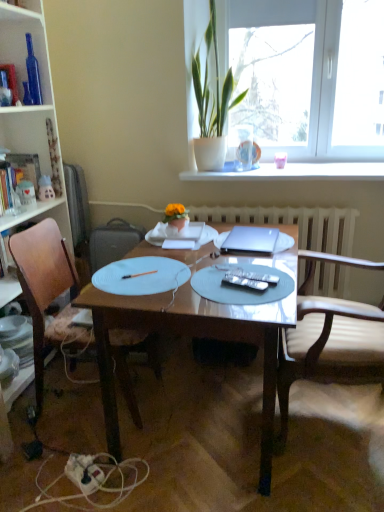
Question: Is silver metallic remote control at center completely or partially outside of satin silver laptop at center?

Choices:
 (A) yes
 (B) no

Answer: (A)

Question: From the image's perspective, is silver metallic remote control at center on top of satin silver laptop at center?

Choices:
 (A) yes
 (B) no

Answer: (B)

Question: Considering the relative sizes of silver metallic remote control at center and satin silver laptop at center in the image provided, is silver metallic remote control at center wider than satin silver laptop at center?

Choices:
 (A) yes
 (B) no

Answer: (B)

Question: From the image's perspective, is silver metallic remote control at center under satin silver laptop at center?

Choices:
 (A) yes
 (B) no

Answer: (A)

Question: Does silver metallic remote control at center have a smaller size compared to satin silver laptop at center?

Choices:
 (A) yes
 (B) no

Answer: (A)

Question: Does silver metallic remote control at center have a greater height compared to satin silver laptop at center?

Choices:
 (A) no
 (B) yes

Answer: (A)

Question: Does white matte paper plate at center, the first paper plate in the left-to-right sequence, have a lesser width compared to silver metallic remote control at center?

Choices:
 (A) no
 (B) yes

Answer: (A)

Question: Considering the relative positions of white matte paper plate at center, the first paper plate in the left-to-right sequence, and silver metallic remote control at center in the image provided, is white matte paper plate at center, the first paper plate in the left-to-right sequence, to the left of silver metallic remote control at center from the viewer's perspective?

Choices:
 (A) no
 (B) yes

Answer: (B)

Question: Does white matte paper plate at center, the first paper plate in the left-to-right sequence, have a greater height compared to silver metallic remote control at center?

Choices:
 (A) yes
 (B) no

Answer: (B)

Question: Can you confirm if white matte paper plate at center, the first paper plate in the left-to-right sequence, is smaller than silver metallic remote control at center?

Choices:
 (A) yes
 (B) no

Answer: (B)

Question: Considering the relative positions of white matte paper plate at center, the first paper plate in the left-to-right sequence, and silver metallic remote control at center in the image provided, is white matte paper plate at center, the first paper plate in the left-to-right sequence, to the right of silver metallic remote control at center from the viewer's perspective?

Choices:
 (A) no
 (B) yes

Answer: (A)

Question: Is white matte paper plate at center, arranged as the second paper plate when viewed from the right, wider than silver metallic remote control at center?

Choices:
 (A) no
 (B) yes

Answer: (B)

Question: From a real-world perspective, is matte white plate at lower left located beneath white paper notebook at center?

Choices:
 (A) yes
 (B) no

Answer: (A)